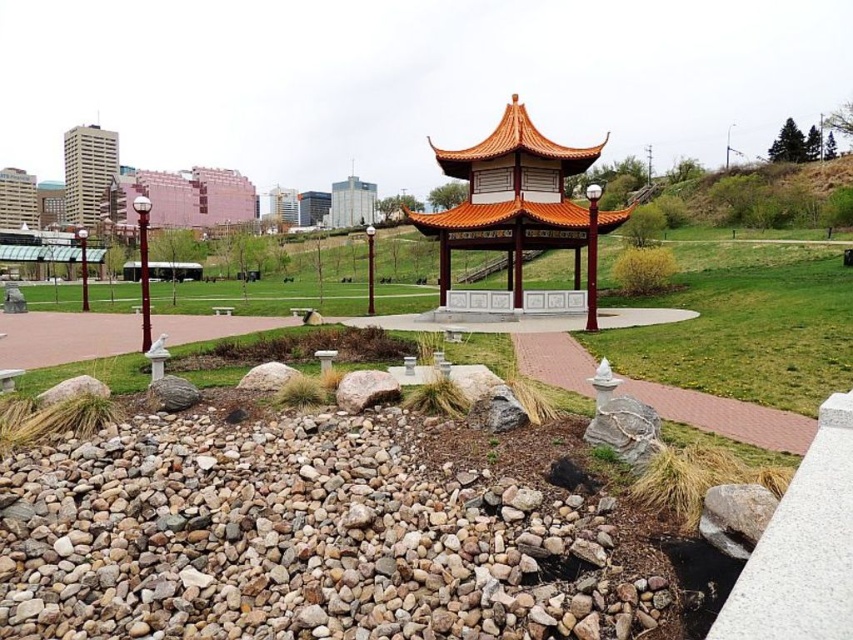
Question: Which of the following is the closest to the observer?

Choices:
 (A) beige concrete tower at upper left
 (B) orange wood gazebo at center

Answer: (B)

Question: Is gray gravel rocks at lower left smaller than beige concrete tower at upper left?

Choices:
 (A) yes
 (B) no

Answer: (A)

Question: Which object is closer to the camera taking this photo?

Choices:
 (A) orange wood gazebo at center
 (B) beige concrete tower at upper left
 (C) gray gravel rocks at lower left

Answer: (C)

Question: Can you confirm if gray gravel rocks at lower left is wider than orange wood gazebo at center?

Choices:
 (A) no
 (B) yes

Answer: (A)

Question: Estimate the real-world distances between objects in this image. Which object is farther from the beige concrete tower at upper left?

Choices:
 (A) gray gravel rocks at lower left
 (B) orange wood gazebo at center

Answer: (A)

Question: Does gray gravel rocks at lower left come in front of orange wood gazebo at center?

Choices:
 (A) yes
 (B) no

Answer: (A)